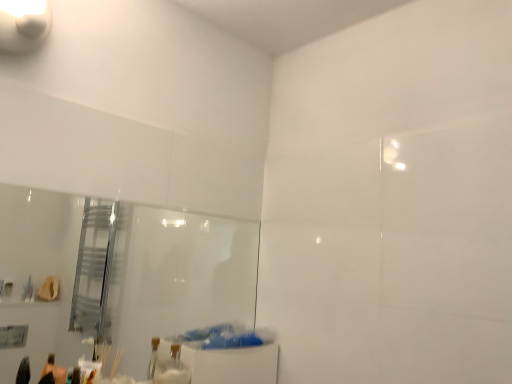
The height and width of the screenshot is (384, 512). What do you see at coordinates (175, 277) in the screenshot?
I see `clear glass mirror at upper left` at bounding box center [175, 277].

You are a GUI agent. You are given a task and a screenshot of the screen. Output one action in this format:
    pyautogui.click(x=<x>, y=<y>)
    Task: Click on the clear glass mirror at upper left
    Image resolution: width=512 pixels, height=384 pixels.
    Given the screenshot: What is the action you would take?
    pyautogui.click(x=175, y=277)

Find the location of a particular element. Image resolution: width=512 pixels, height=384 pixels. clear glass mirror at upper left is located at coordinates (175, 277).